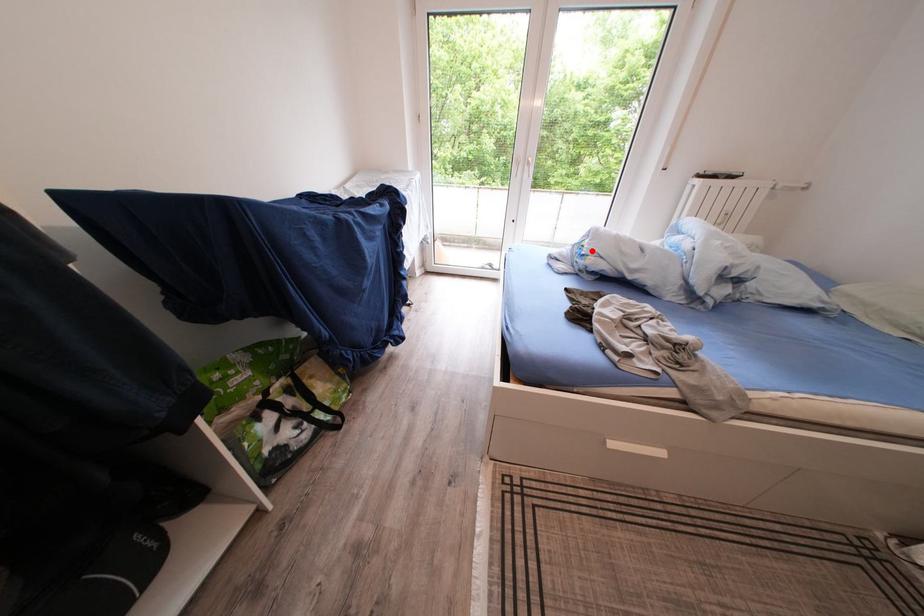
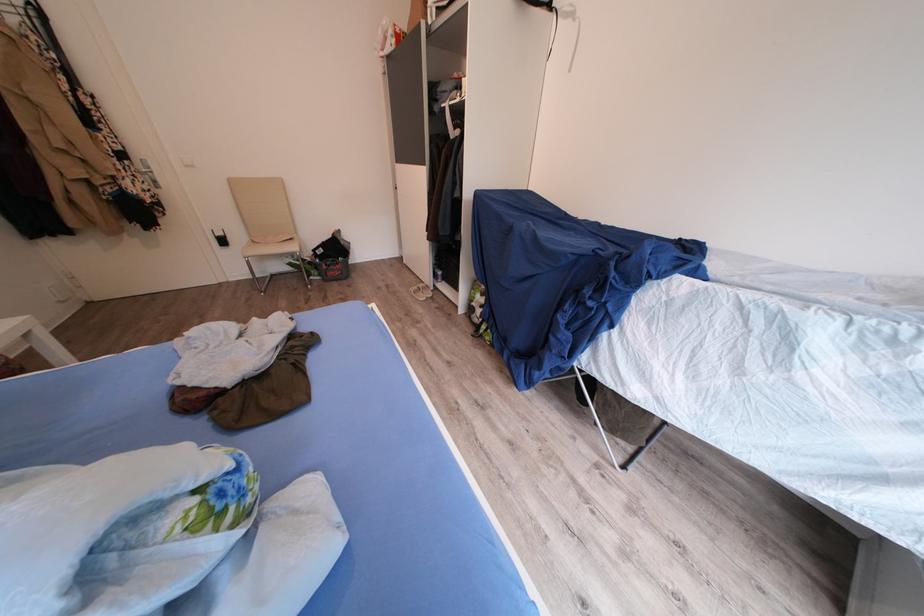
Question: I am providing you with two images of the same scene from different viewpoints. Image1 has a red point marked. In image2, the corresponding 3D location appears at what relative position? Reply with the corresponding letter.

Choices:
 (A) Closer
 (B) Farther

Answer: (B)